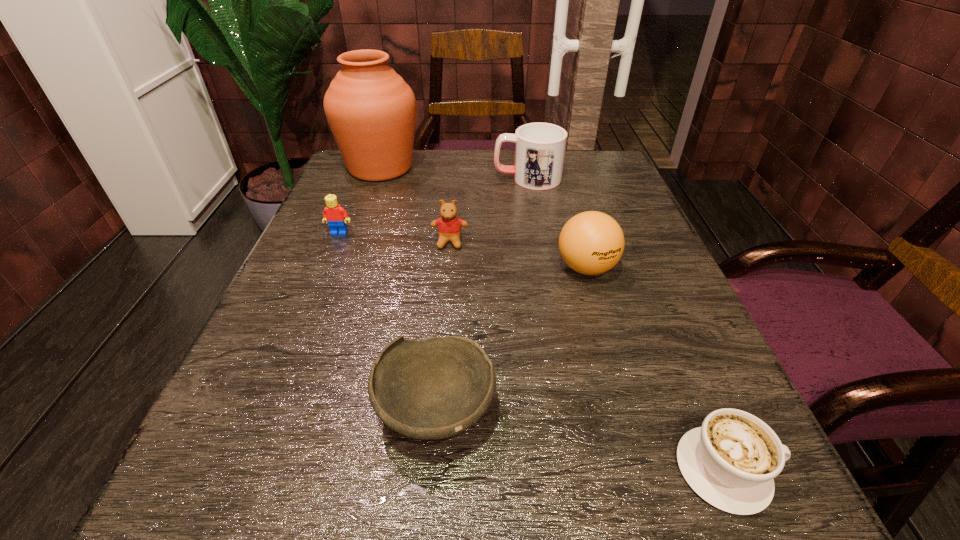
Image resolution: width=960 pixels, height=540 pixels. I want to click on vacant area at the far left corner of the desktop, so click(357, 185).

Find the location of a particular element. The width and height of the screenshot is (960, 540). vacant space at the far right corner is located at coordinates (586, 190).

You are a GUI agent. You are given a task and a screenshot of the screen. Output one action in this format:
    pyautogui.click(x=<x>, y=<y>)
    Task: Click on the free point between the ping-pong ball and the teddy bear
    
    Given the screenshot: What is the action you would take?
    pyautogui.click(x=517, y=255)

Where is `free space between the bowl and the Lego`? The height and width of the screenshot is (540, 960). free space between the bowl and the Lego is located at coordinates (387, 322).

At what (x,y) coordinates should I click in order to perform the action: click on free space between the cappuccino and the teddy bear. Please return your answer as a coordinate pair (x, y). This screenshot has height=540, width=960. Looking at the image, I should click on (588, 356).

Find the location of a particular element. The width and height of the screenshot is (960, 540). free space between the bowl and the Lego is located at coordinates (387, 322).

I want to click on vacant point located between the urn and the ping-pong ball, so click(x=483, y=218).

Where is `unoccupied area between the ping-pong ball and the cappuccino`? The image size is (960, 540). unoccupied area between the ping-pong ball and the cappuccino is located at coordinates (656, 369).

The width and height of the screenshot is (960, 540). In order to click on free space between the Lego and the tallest object in this screenshot , I will do `click(360, 200)`.

Find the location of a particular element. This screenshot has width=960, height=540. vacant point located between the bowl and the teddy bear is located at coordinates click(443, 326).